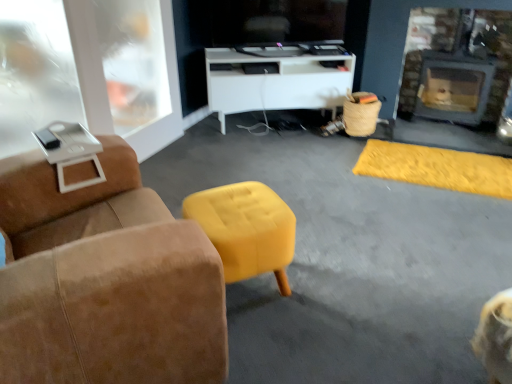
You are a GUI agent. You are given a task and a screenshot of the screen. Output one action in this format:
    pyautogui.click(x=<x>, y=<y>)
    Task: Click on the free point in front of yellow fabric ottoman at center
    Image resolution: width=512 pixels, height=384 pixels.
    Given the screenshot: What is the action you would take?
    pyautogui.click(x=440, y=228)